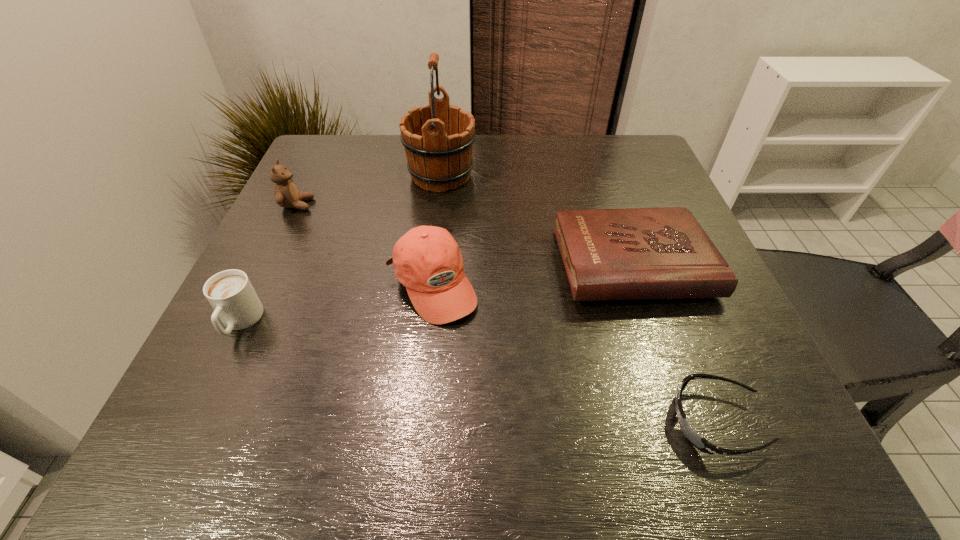
Locate an element on the screen. The image size is (960, 540). wine bucket is located at coordinates (438, 139).

Image resolution: width=960 pixels, height=540 pixels. Find the location of `teddy bear`. teddy bear is located at coordinates (286, 194).

Identify the location of baseball cap. (427, 260).

This screenshot has width=960, height=540. What are the coordinates of `cappuccino` in the screenshot? It's located at (231, 294).

The height and width of the screenshot is (540, 960). I want to click on hardback book, so [638, 253].

Image resolution: width=960 pixels, height=540 pixels. What are the coordinates of `the nearest object` in the screenshot? It's located at (692, 436).

Locate an element on the screen. The height and width of the screenshot is (540, 960). sunglasses is located at coordinates (692, 436).

Locate an element on the screen. Image resolution: width=960 pixels, height=540 pixels. free space located 0.310m on the front of the wine bucket is located at coordinates (428, 297).

The image size is (960, 540). What are the coordinates of `free space located on the front-facing side of the teddy bear` in the screenshot? It's located at (343, 205).

Find the location of `blank area located on the back of the baseball cap`. blank area located on the back of the baseball cap is located at coordinates (441, 199).